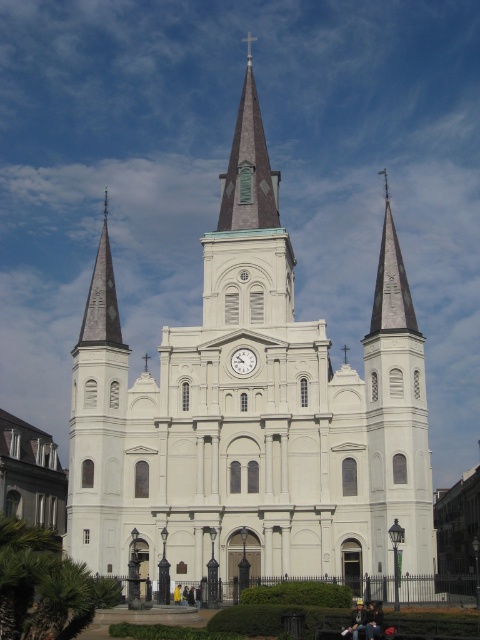
Question: Which object appears farthest from the camera in this image?

Choices:
 (A) white stone steeple at left
 (B) white smooth church at center
 (C) matte white clock at center

Answer: (C)

Question: Is white smooth church at center wider than white stone steeple at left?

Choices:
 (A) no
 (B) yes

Answer: (B)

Question: Is the position of white smooth church at center more distant than that of matte white clock at center?

Choices:
 (A) no
 (B) yes

Answer: (A)

Question: Which is farther from the green copper spire at upper center?

Choices:
 (A) white smooth church at center
 (B) white stone steeple at left

Answer: (B)

Question: Observing the image, what is the correct spatial positioning of white stone steeple at left in reference to green copper spire at upper center?

Choices:
 (A) above
 (B) below

Answer: (B)

Question: Which of these objects is positioned closest to the white smooth church at center?

Choices:
 (A) matte white clock at center
 (B) green copper spire at upper center
 (C) white stone steeple at left

Answer: (C)